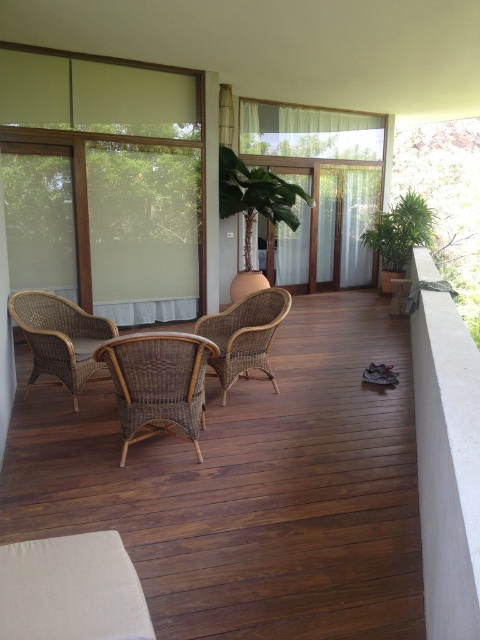
Question: Is brown wicker chairs at center further to the viewer compared to woven rattan armchair at center?

Choices:
 (A) no
 (B) yes

Answer: (A)

Question: Which of the following is the farthest from the observer?

Choices:
 (A) woven rattan armchair at center
 (B) green leafy plant at right

Answer: (B)

Question: Which of the following is the closest to the observer?

Choices:
 (A) (64, 356)
 (B) (142, 422)
 (C) (400, 243)
 (D) (285, 301)

Answer: (B)

Question: Can you confirm if woven rattan chair at center is smaller than green leafy plant at right?

Choices:
 (A) yes
 (B) no

Answer: (A)

Question: Which point appears closest to the camera in this image?

Choices:
 (A) (36, 348)
 (B) (252, 314)
 (C) (327, 637)

Answer: (C)

Question: Can you confirm if brown wicker chairs at center is positioned to the right of woven rattan armchair at center?

Choices:
 (A) no
 (B) yes

Answer: (A)